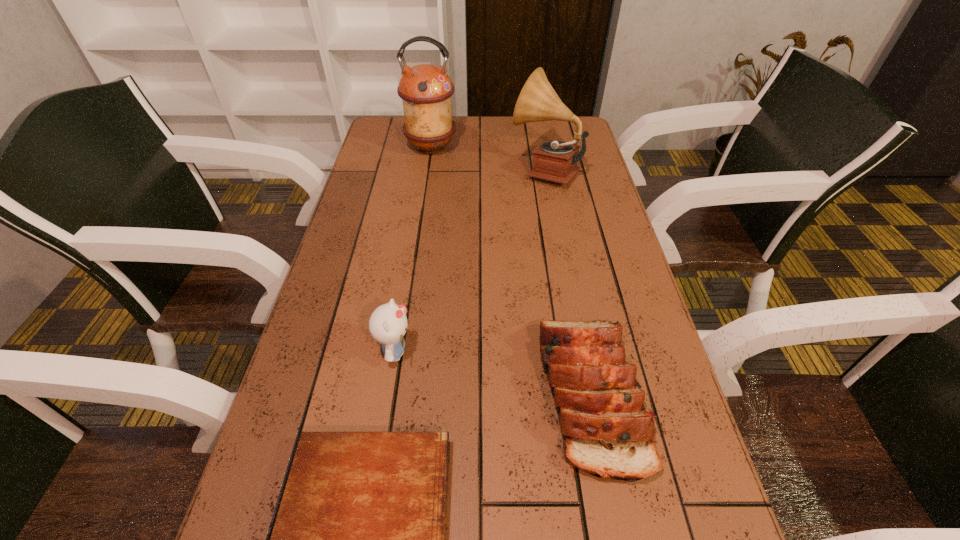
Where is `free space that satisfies the following two spatial constraints: 1. on the front-facing side of the third shortest object; 2. on the right side of the fourth tallest object`? free space that satisfies the following two spatial constraints: 1. on the front-facing side of the third shortest object; 2. on the right side of the fourth tallest object is located at coordinates (389, 396).

Find the location of `free space that satisfies the following two spatial constraints: 1. on the back side of the second shortest object; 2. on the front-facing side of the third shortest object`. free space that satisfies the following two spatial constraints: 1. on the back side of the second shortest object; 2. on the front-facing side of the third shortest object is located at coordinates (582, 352).